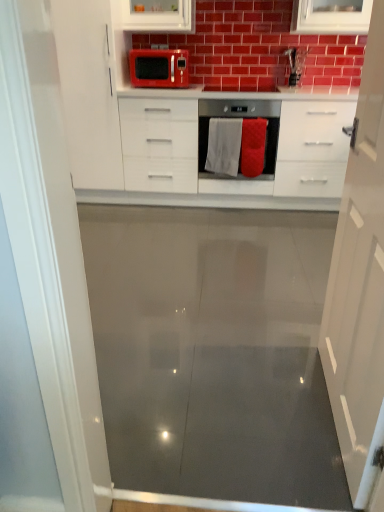
Question: From the image's perspective, would you say matte red microwave at upper center is shown under satin silver oven at center?

Choices:
 (A) yes
 (B) no

Answer: (B)

Question: Is matte red microwave at upper center far away from satin silver oven at center?

Choices:
 (A) yes
 (B) no

Answer: (B)

Question: Can you confirm if matte red microwave at upper center is bigger than satin silver oven at center?

Choices:
 (A) no
 (B) yes

Answer: (A)

Question: Does matte red microwave at upper center have a lesser width compared to satin silver oven at center?

Choices:
 (A) no
 (B) yes

Answer: (B)

Question: Is matte red microwave at upper center behind satin silver oven at center?

Choices:
 (A) no
 (B) yes

Answer: (B)

Question: Does matte red microwave at upper center lie in front of satin silver oven at center?

Choices:
 (A) no
 (B) yes

Answer: (A)

Question: Does white glossy cabinet at center lie behind matte red microwave at upper center?

Choices:
 (A) no
 (B) yes

Answer: (A)

Question: Is white glossy cabinet at center taller than matte red microwave at upper center?

Choices:
 (A) no
 (B) yes

Answer: (B)

Question: Is white glossy cabinet at center directly adjacent to matte red microwave at upper center?

Choices:
 (A) yes
 (B) no

Answer: (B)

Question: Considering the relative sizes of white glossy cabinet at center and matte red microwave at upper center in the image provided, is white glossy cabinet at center smaller than matte red microwave at upper center?

Choices:
 (A) no
 (B) yes

Answer: (A)

Question: From the image's perspective, is white glossy cabinet at center located above matte red microwave at upper center?

Choices:
 (A) yes
 (B) no

Answer: (B)

Question: Can you confirm if white glossy cabinet at center is shorter than matte red microwave at upper center?

Choices:
 (A) no
 (B) yes

Answer: (A)

Question: Is red fabric towel at center, which ranks as the first material in right-to-left order, outside white fabric towel at center, which is the 1th material from left to right?

Choices:
 (A) no
 (B) yes

Answer: (B)